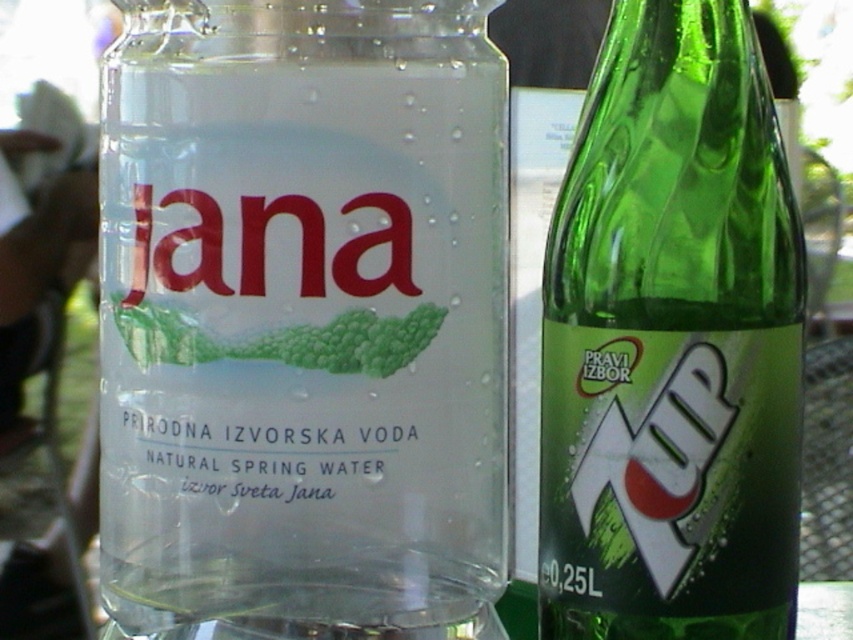
How far apart are transparent glass bottle at center and green glass bottle at right?

transparent glass bottle at center is 2.07 inches from green glass bottle at right.

Is transparent glass bottle at center thinner than green glass bottle at right?

No.

Who is more distant from viewer, (254, 538) or (676, 352)?

The point (254, 538) is behind.

At what (x,y) coordinates should I click in order to perform the action: click on transparent glass bottle at center. Please return your answer as a coordinate pair (x, y). The height and width of the screenshot is (640, 853). Looking at the image, I should click on (303, 317).